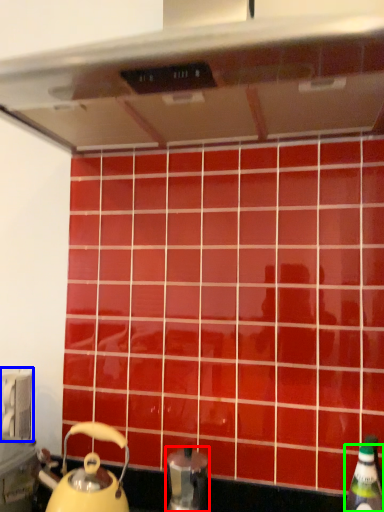
Question: Based on their relative distances, which object is nearer to kitchen appliance (highlighted by a red box)? Choose from appliance (highlighted by a blue box) and bottle (highlighted by a green box).

Choices:
 (A) appliance
 (B) bottle

Answer: (B)